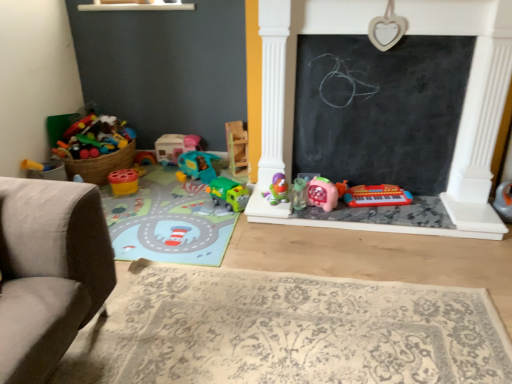
Locate an element on the screen. This screenshot has height=384, width=512. unoccupied region to the right of matte plastic cup at center-left, acting as the 10th toy starting from the right is located at coordinates pyautogui.click(x=155, y=185).